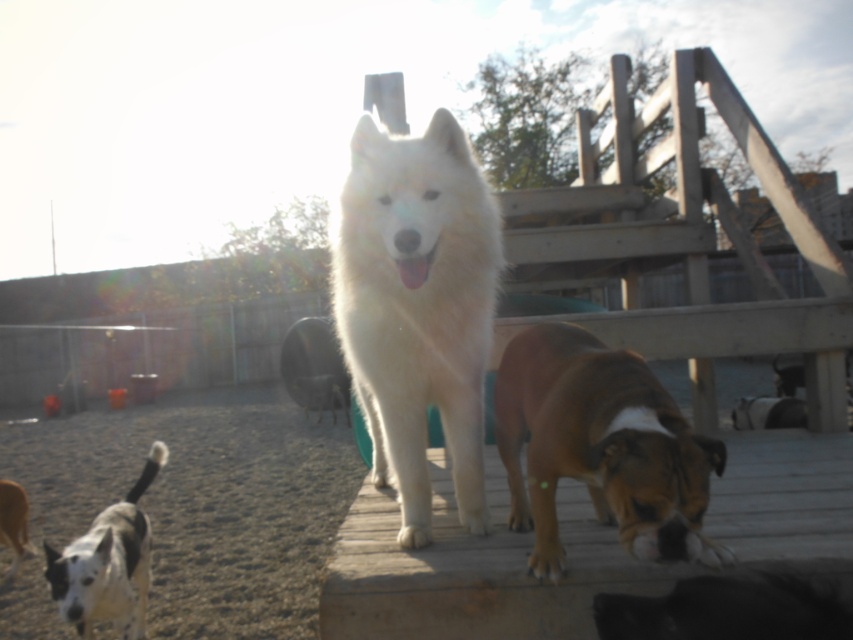
You are standing at the camera position and see two points in the image. Which point is closer to you, point (418, 545) or point (498, 400)?

Point (418, 545) is in front of point (498, 400), so it is closer to you.